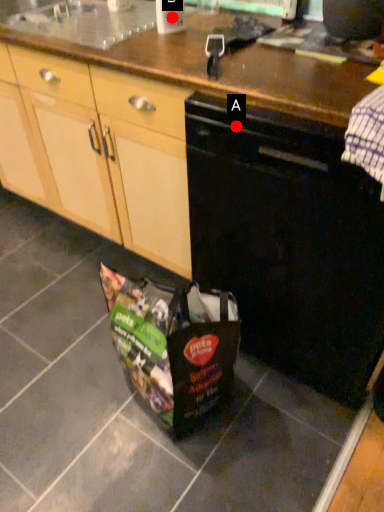
Question: Two points are circled on the image, labeled by A and B beside each circle. Which of the following is the closest to the observer?

Choices:
 (A) A is closer
 (B) B is closer

Answer: (A)